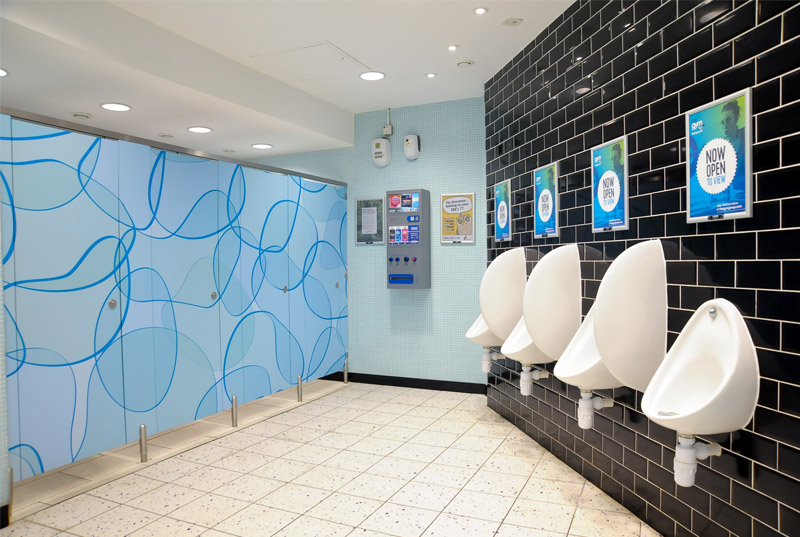
Image resolution: width=800 pixels, height=537 pixels. In order to click on ceiling in this screenshot , I will do `click(270, 30)`.